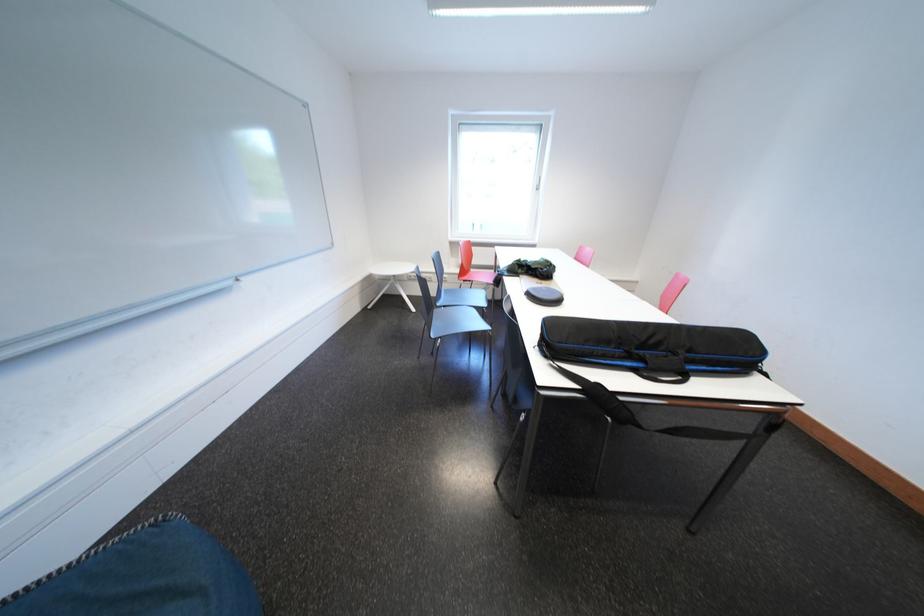
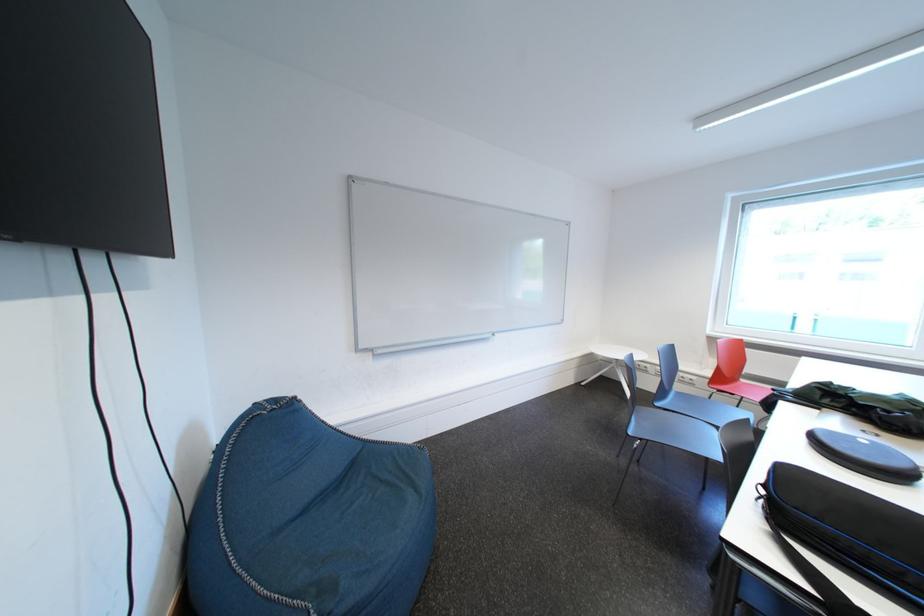
Question: The camera is either moving clockwise (left) or counter-clockwise (right) around the object. The first image is from the beginning of the video and the second image is from the end. Is the camera moving left or right when shooting the video?

Choices:
 (A) Left
 (B) Right

Answer: (B)